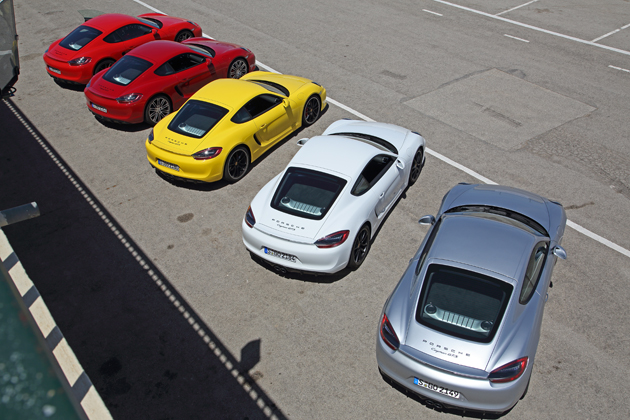
This screenshot has height=420, width=630. I want to click on doors, so click(387, 196), click(278, 127), click(190, 79), click(130, 40).